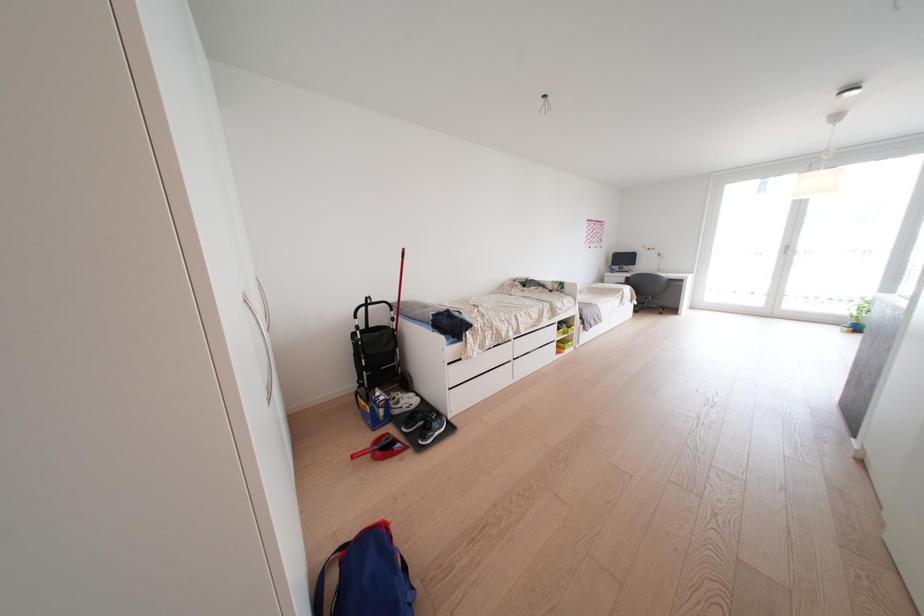
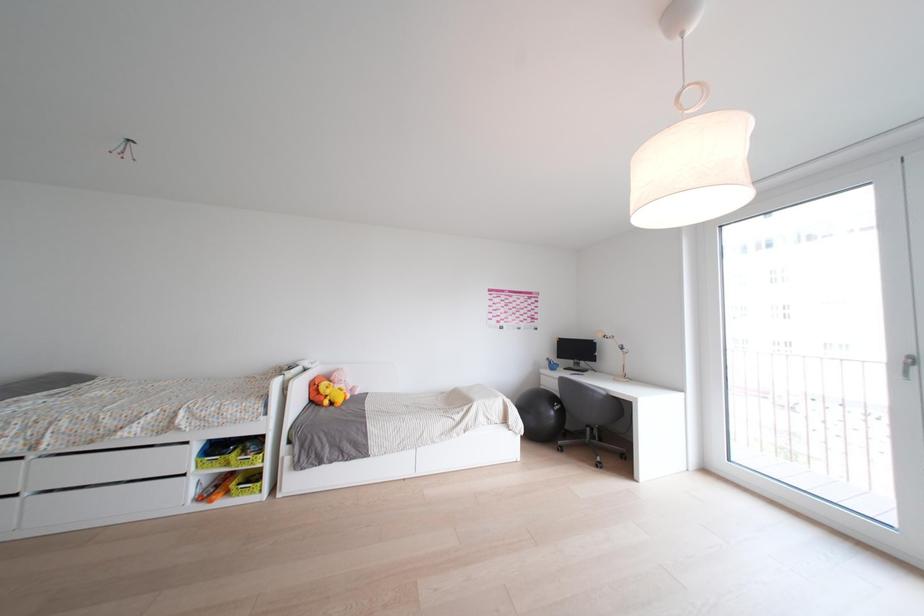
The images are taken continuously from a first-person perspective. In which direction are you moving?

The cameraman walked toward right, forward.